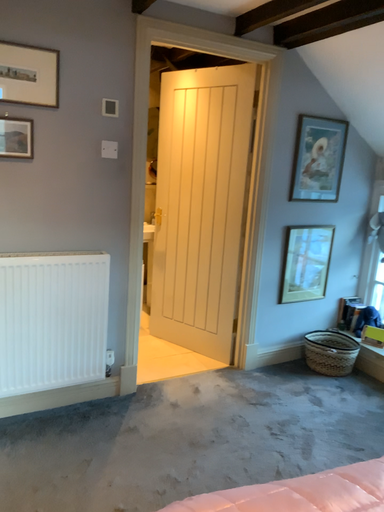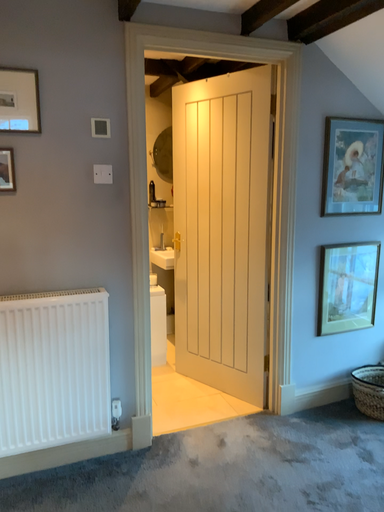
Question: How did the camera likely rotate when shooting the video?

Choices:
 (A) rotated right
 (B) rotated left

Answer: (B)